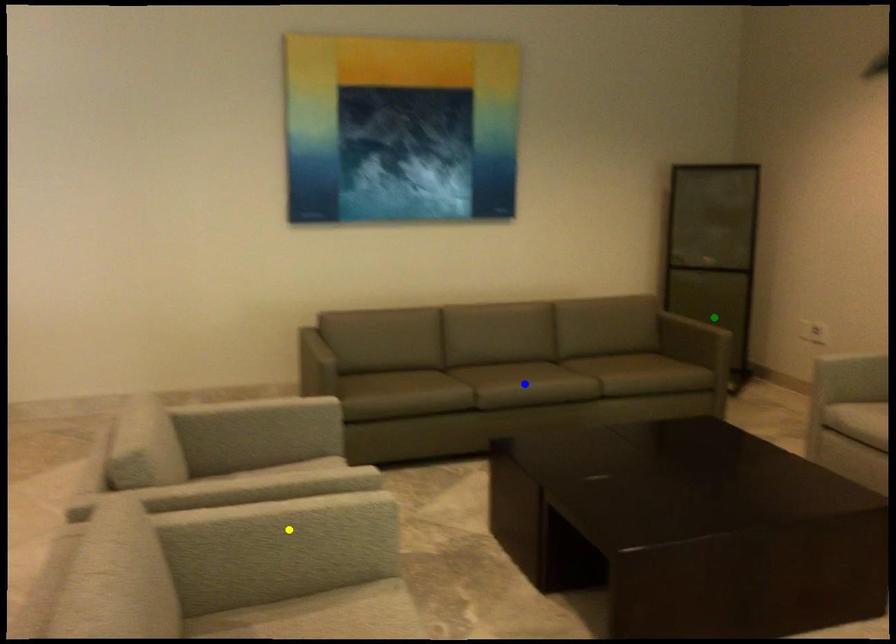
Order these from nearest to farthest:
blue point | yellow point | green point

yellow point → blue point → green point